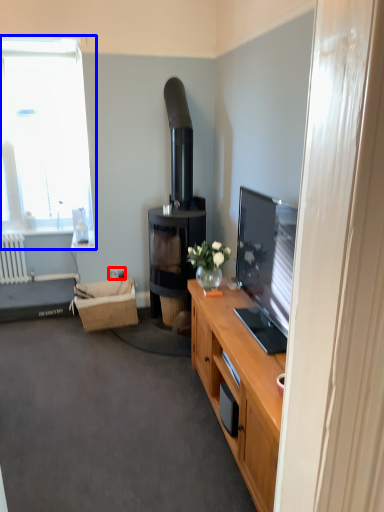
Question: Which of the following is the closest to the observer, power outlet (highlighted by a red box) or window (highlighted by a blue box)?

Choices:
 (A) power outlet
 (B) window

Answer: (A)